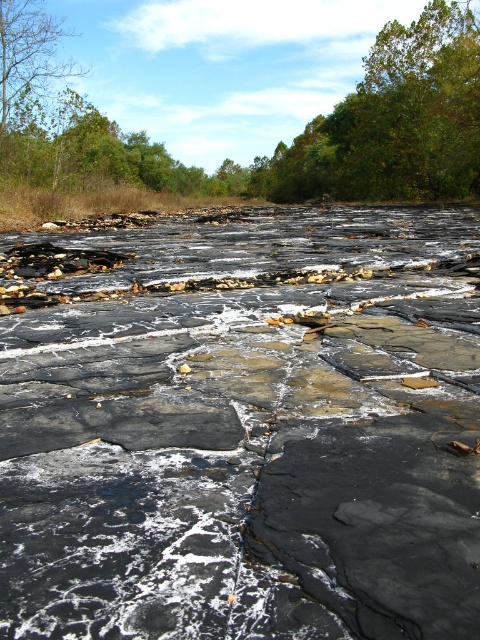
You are standing at the point marked as point (242, 426) in the image. What is the nearest object to you?

The nearest object to you is the black stone creek at center, which is located exactly at the point (242, 426).

You are standing at the origin point in the image. You see two points marked as point 1 at coordinates point (107, 148) and point 2 at coordinates point (0, 144). Which point is closer to you?

Point 2 at coordinates point (0, 144) is closer to you because it is in front of point 1 at coordinates point (107, 148).

You are standing at the edge of the rocky riverbed and want to identify the larger tree between the green leafy tree at upper center and the brown leafy tree at upper left. Which one should you point to?

The green leafy tree at upper center is bigger than the brown leafy tree at upper left, so you should point to the green leafy tree at upper center.